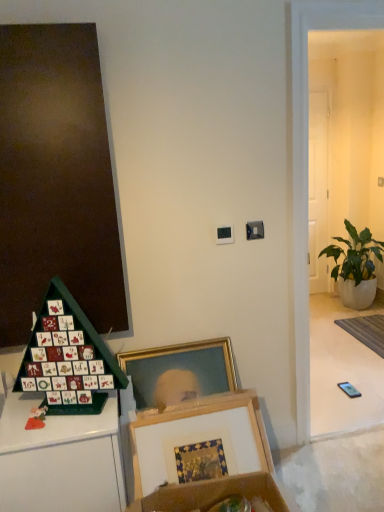
The height and width of the screenshot is (512, 384). I want to click on vacant space in front of white glossy door at right, so click(319, 295).